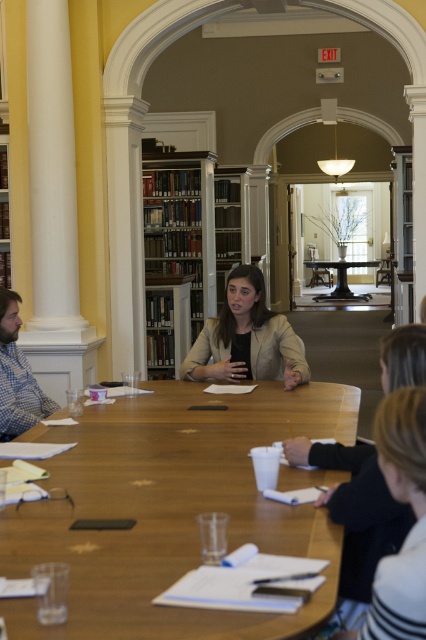
You are organizing a small event and need to know the relative sizes of the items in the scene. Which object, the beige textured blazer at center or the black metal table at center, is smaller in size?

The beige textured blazer at center is smaller in size compared to the black metal table at center.

In the scene shown: You are a photographer taking a picture of the meeting. You notice two points in the scene, point (127, 419) and point (339, 276). Which point will appear larger in your photo?

Point (127, 419) is closer to the camera than point (339, 276), so it will appear larger in the photo.